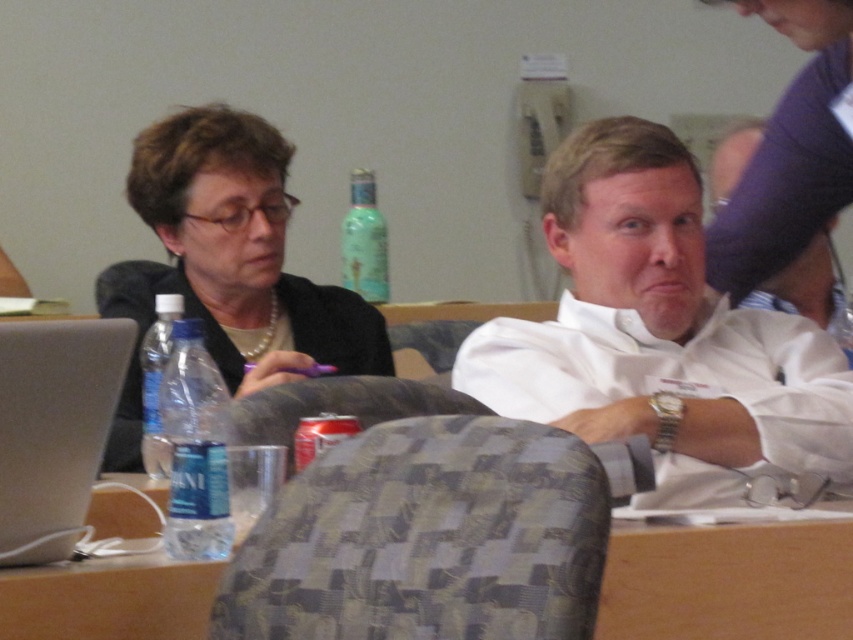
Question: Can you confirm if white shirt at center is smaller than wooden table at center?

Choices:
 (A) no
 (B) yes

Answer: (A)

Question: Observing the image, what is the correct spatial positioning of textured fabric chair at center in reference to plaid fabric chair at center?

Choices:
 (A) above
 (B) below

Answer: (B)

Question: Which of the following is the closest to the observer?

Choices:
 (A) (209, 324)
 (B) (312, 410)

Answer: (B)

Question: Is white shirt at center thinner than plaid fabric chair at center?

Choices:
 (A) no
 (B) yes

Answer: (A)

Question: Which point is closer to the camera taking this photo?

Choices:
 (A) (86, 387)
 (B) (39, 588)
 (C) (242, 403)
 (D) (378, 440)

Answer: (B)

Question: Which object is positioned farthest from the textured fabric chair at center?

Choices:
 (A) pearl necklace at left
 (B) silver metallic laptop at left
 (C) plaid fabric chair at center
 (D) white shirt at center

Answer: (A)